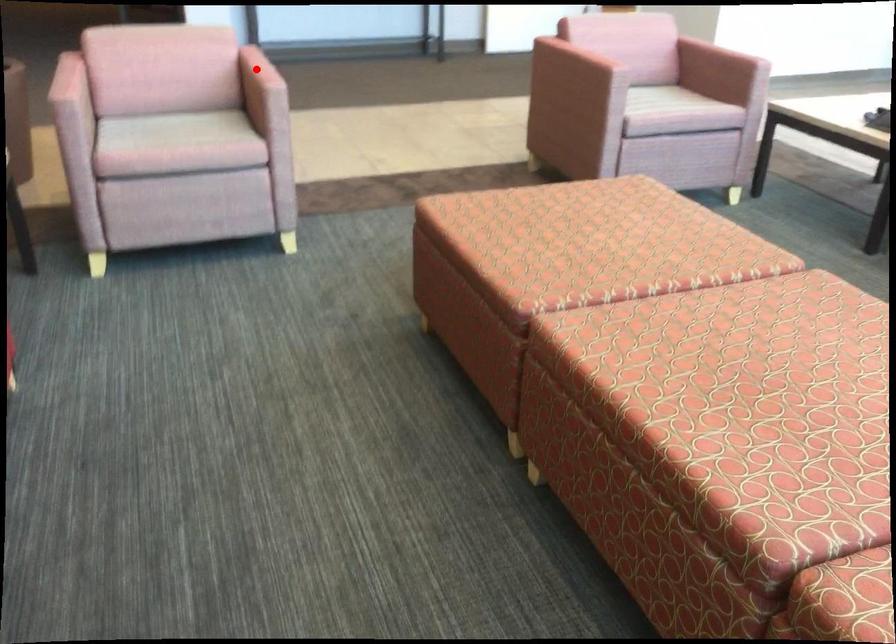
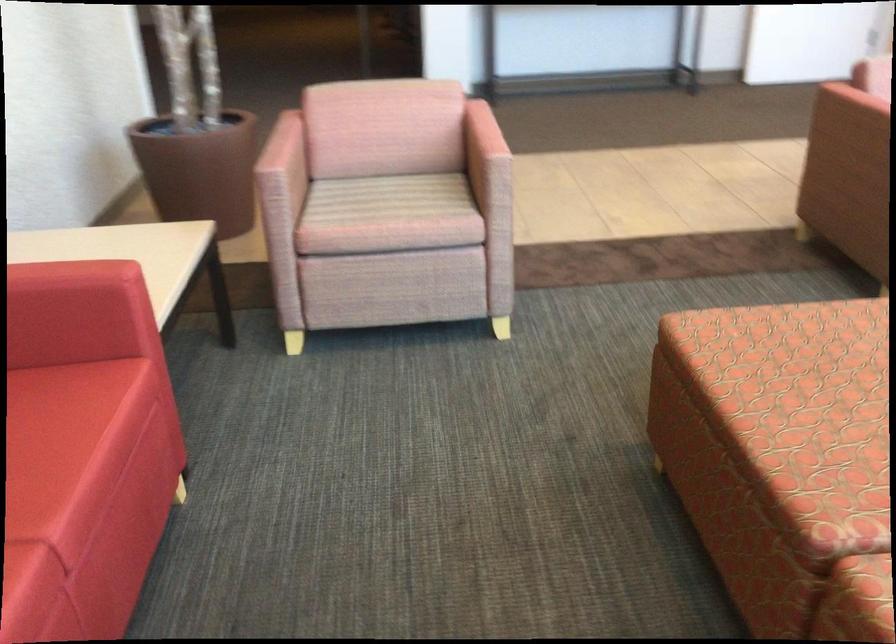
Question: I am providing you with two images of the same scene from different viewpoints. A red point is shown in image1. For the corresponding object point in image2, is it positioned nearer or farther from the camera?

Choices:
 (A) Nearer
 (B) Farther

Answer: (A)